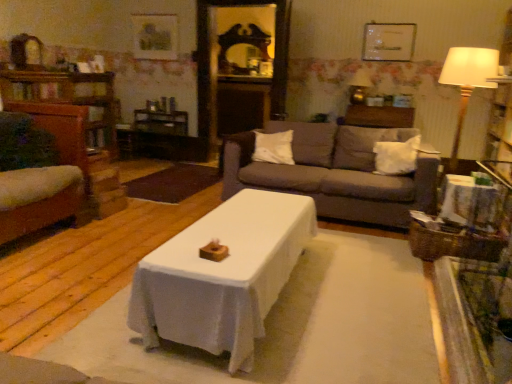
Question: Could you tell me if wooden side table at right is facing matte gold lamp at upper right?

Choices:
 (A) no
 (B) yes

Answer: (A)

Question: Considering the relative positions of wooden side table at right and matte gold lamp at upper right in the image provided, is wooden side table at right to the left of matte gold lamp at upper right from the viewer's perspective?

Choices:
 (A) no
 (B) yes

Answer: (A)

Question: Considering the relative positions of wooden side table at right and matte gold lamp at upper right in the image provided, is wooden side table at right to the right of matte gold lamp at upper right from the viewer's perspective?

Choices:
 (A) yes
 (B) no

Answer: (A)

Question: Is wooden side table at right looking in the opposite direction of matte gold lamp at upper right?

Choices:
 (A) no
 (B) yes

Answer: (A)

Question: Are wooden side table at right and matte gold lamp at upper right beside each other?

Choices:
 (A) yes
 (B) no

Answer: (B)

Question: From a real-world perspective, is matte white picture frame at upper center, which is counted as the first picture frame, starting from the front, positioned above or below wooden side table at right?

Choices:
 (A) below
 (B) above

Answer: (B)

Question: Would you say matte white picture frame at upper center, which is counted as the first picture frame, starting from the front, is to the left or to the right of wooden side table at right in the picture?

Choices:
 (A) right
 (B) left

Answer: (B)

Question: Is point (392, 61) positioned closer to the camera than point (493, 195)?

Choices:
 (A) farther
 (B) closer

Answer: (A)

Question: Considering the positions of matte white picture frame at upper center, which ranks as the 1th picture frame in right-to-left order, and wooden side table at right in the image, is matte white picture frame at upper center, which ranks as the 1th picture frame in right-to-left order, wider or thinner than wooden side table at right?

Choices:
 (A) thin
 (B) wide

Answer: (A)

Question: In terms of height, does wooden swivel chair at left look taller or shorter compared to wooden picture frame at upper center, the first picture frame in the back-to-front sequence?

Choices:
 (A) short
 (B) tall

Answer: (B)

Question: Choose the correct answer: Is wooden swivel chair at left inside wooden picture frame at upper center, placed as the 1th picture frame when sorted from left to right, or outside it?

Choices:
 (A) outside
 (B) inside

Answer: (A)

Question: Relative to wooden picture frame at upper center, acting as the second picture frame starting from the front, is wooden swivel chair at left in front or behind?

Choices:
 (A) behind
 (B) front

Answer: (B)

Question: In terms of width, does wooden swivel chair at left look wider or thinner when compared to wooden picture frame at upper center, positioned as the 2th picture frame in right-to-left order?

Choices:
 (A) wide
 (B) thin

Answer: (A)

Question: From their relative heights in the image, would you say white soft pillow at center, positioned as the 1th pillow in right-to-left order, is taller or shorter than wooden picture frame at upper center, acting as the second picture frame starting from the front?

Choices:
 (A) short
 (B) tall

Answer: (A)

Question: Considering the positions of white soft pillow at center, the second pillow positioned from the left, and wooden picture frame at upper center, placed as the 1th picture frame when sorted from left to right, in the image, is white soft pillow at center, the second pillow positioned from the left, bigger or smaller than wooden picture frame at upper center, placed as the 1th picture frame when sorted from left to right,?

Choices:
 (A) small
 (B) big

Answer: (B)